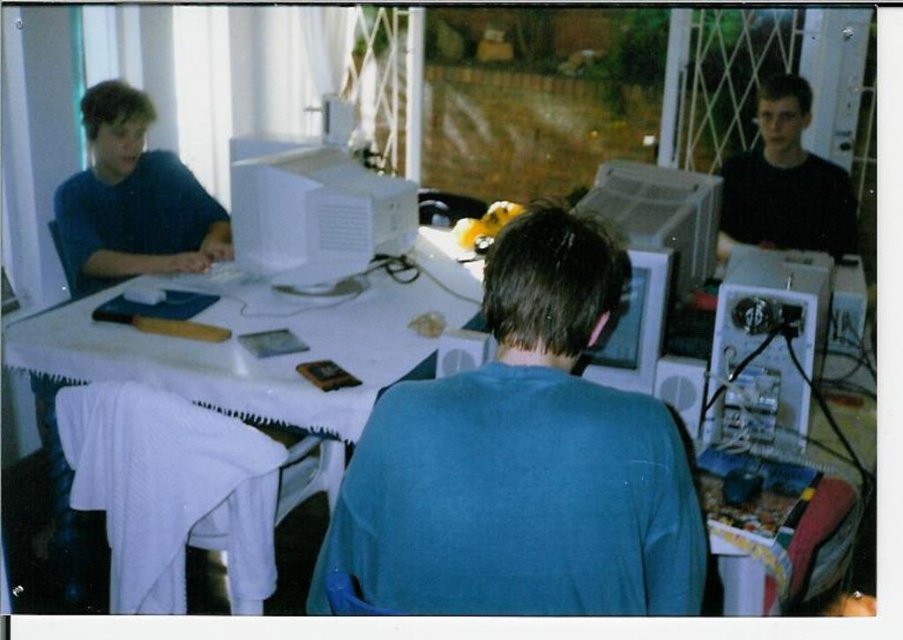
Who is more forward, (x=324, y=541) or (x=414, y=301)?

Point (x=324, y=541)

Can you confirm if blue matte shirt at center is positioned below white cloth-covered table at center?

Yes, blue matte shirt at center is below white cloth-covered table at center.

Find the location of a particular element. Image resolution: width=903 pixels, height=640 pixels. blue matte shirt at center is located at coordinates (522, 461).

Looking at this image, who is positioned more to the right, white plastic desktop computer at center or matte white monitor at center?

matte white monitor at center

Is point (287, 268) farther from viewer compared to point (681, 198)?

Yes, it is behind point (681, 198).

Which is behind, point (412, 216) or point (683, 243)?

Positioned behind is point (412, 216).

Image resolution: width=903 pixels, height=640 pixels. I want to click on white plastic desktop computer at center, so click(313, 212).

Is the position of metallic silver computer at right more distant than that of black matte shirt at upper right?

No, metallic silver computer at right is closer to the viewer.

Is metallic silver computer at right to the right of black matte shirt at upper right from the viewer's perspective?

In fact, metallic silver computer at right is to the left of black matte shirt at upper right.

Describe the element at coordinates (765, 348) in the screenshot. I see `metallic silver computer at right` at that location.

Where is `metallic silver computer at right`? The width and height of the screenshot is (903, 640). metallic silver computer at right is located at coordinates (765, 348).